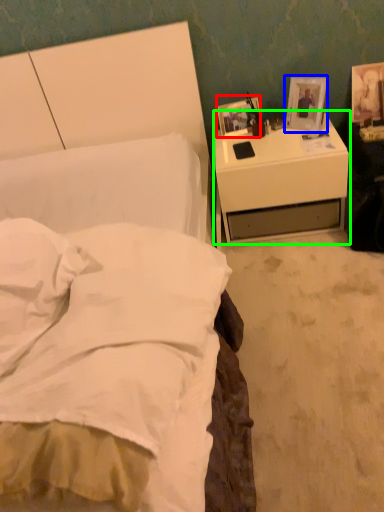
Question: Which is nearer to the picture frame (highlighted by a red box)? picture frame (highlighted by a blue box) or nightstand (highlighted by a green box).

Choices:
 (A) picture frame
 (B) nightstand

Answer: (A)